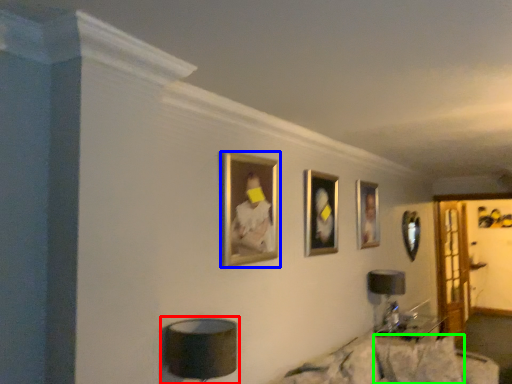
Question: Which object is positioned closest to table lamp (highlighted by a red box)? Select from picture frame (highlighted by a blue box) and pillow (highlighted by a green box).

Choices:
 (A) picture frame
 (B) pillow

Answer: (A)